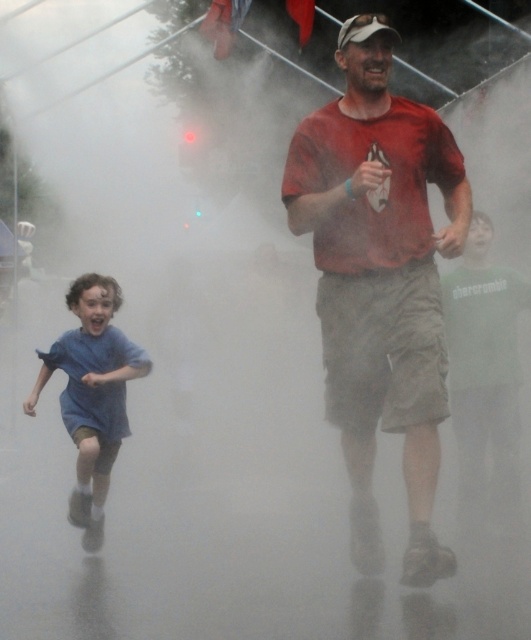
Measure the distance between matte red shirt at center and camera.

matte red shirt at center and camera are 5.11 meters apart.

Identify the location of matte red shirt at center. (380, 280).